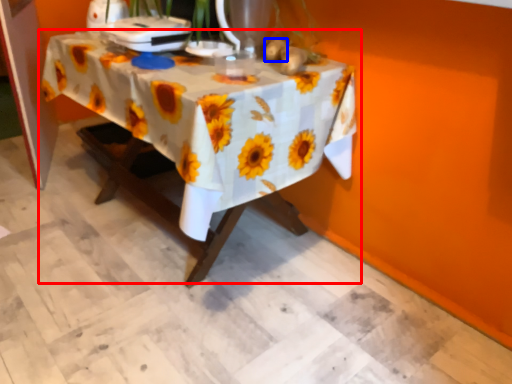
Question: Which point is further to the camera, table (highlighted by a red box) or flower (highlighted by a blue box)?

Choices:
 (A) table
 (B) flower

Answer: (B)